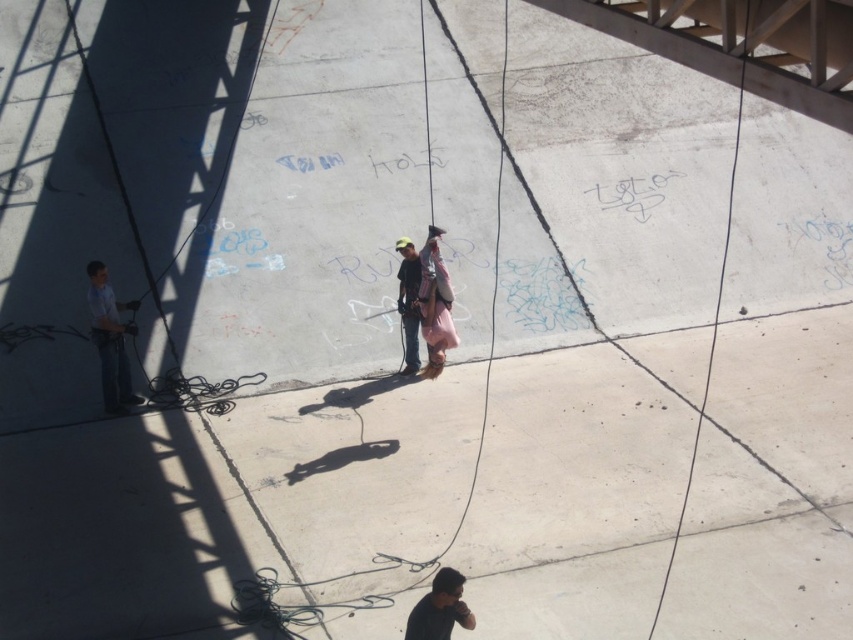
You are standing at the position of the viewer and want to throw a ball to the light blue shirt at left. Considering the distance, is it feasible to do so without any obstacles?

The light blue shirt at left is 11.18 meters away from the viewer. Throwing a ball that distance is possible for an adult, so yes, it is feasible to throw the ball to the light blue shirt at left without obstacles.

You are standing at the point marked as point (109,340) in the image. What object are you currently standing on?

You are standing on the light blue shirt at left.

You are a photographer trying to capture a group photo of the light blue shirt at left and the matte black shirt at center. Since you want them to appear side by side in the photo, which one should you position to your left to frame them correctly?

To frame them correctly, position the light blue shirt at left to your left because it is already on the left side of the matte black shirt at center in the scene.